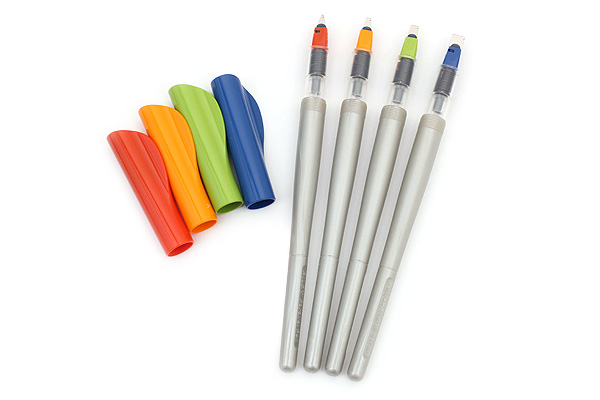
Find the location of `pen`. pen is located at coordinates click(316, 120), click(344, 128), click(395, 133), click(422, 148).